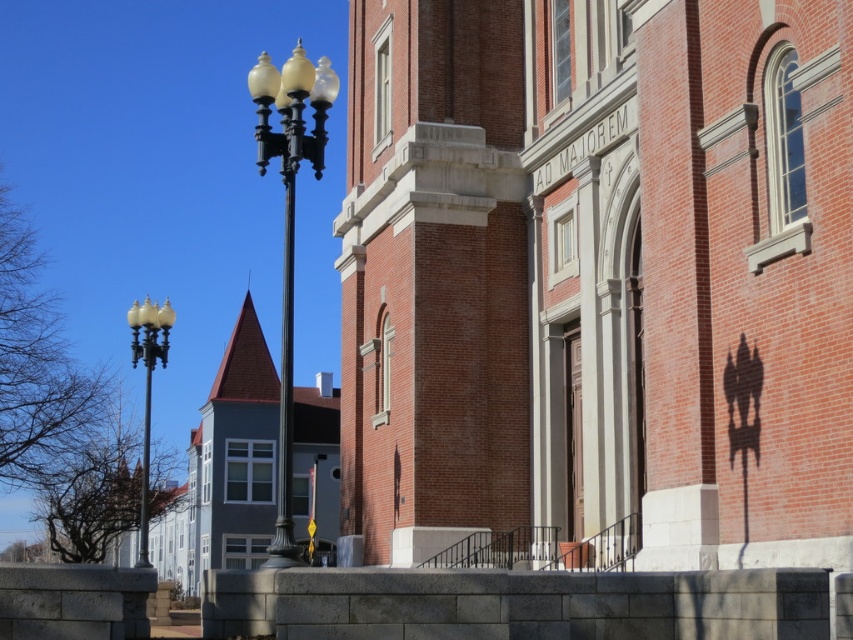
You are standing in front of the brick building and want to take a photo that includes both the matte black lamp post at left and the black metal pole at left. Which object should you position closer to the camera to ensure both are fully visible in the frame?

Since the matte black lamp post at left is much taller than the black metal pole at left, you should position the matte black lamp post at left closer to the camera to ensure both objects are fully visible in the frame.